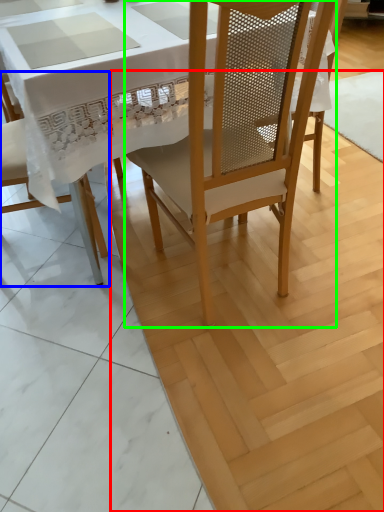
Question: Considering the real-world distances, which object is farthest from plywood (highlighted by a red box)? chair (highlighted by a blue box) or chair (highlighted by a green box)?

Choices:
 (A) chair
 (B) chair

Answer: (A)